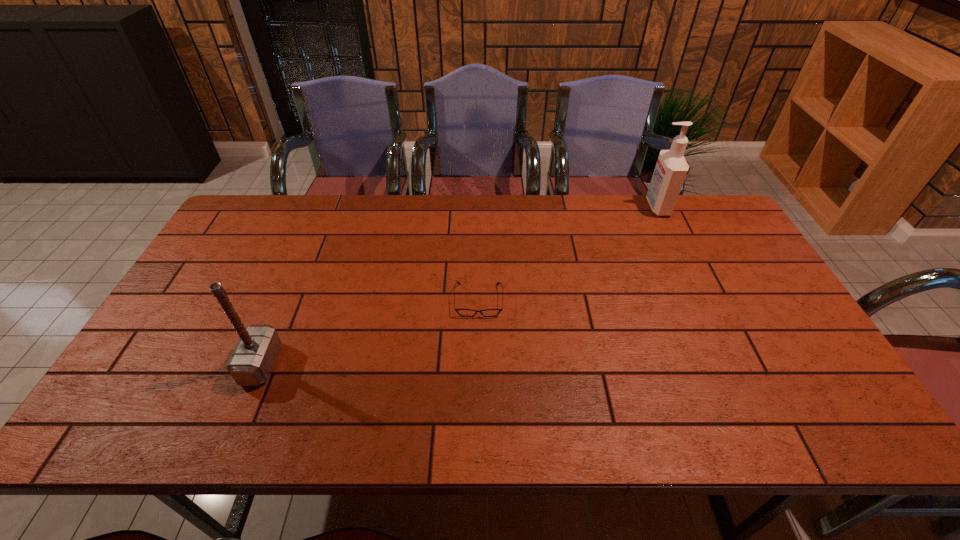
Find the location of a particular element. The image size is (960, 540). free space that satisfies the following two spatial constraints: 1. on the front label of the rightmost object; 2. on the front-facing side of the second farthest object is located at coordinates (702, 300).

At what (x,y) coordinates should I click in order to perform the action: click on vacant space that satisfies the following two spatial constraints: 1. on the front label of the cleansing agent; 2. on the front-facing side of the second farthest object. Please return your answer as a coordinate pair (x, y). This screenshot has height=540, width=960. Looking at the image, I should click on (702, 300).

In order to click on blank area in the image that satisfies the following two spatial constraints: 1. on the front label of the cleansing agent; 2. on the front-facing side of the spectacles in this screenshot , I will do `click(702, 300)`.

Locate an element on the screen. free point that satisfies the following two spatial constraints: 1. on the front label of the rightmost object; 2. on the front-facing side of the second nearest object is located at coordinates (702, 300).

At what (x,y) coordinates should I click in order to perform the action: click on free spot that satisfies the following two spatial constraints: 1. on the front label of the rightmost object; 2. on the front-facing side of the spectacles. Please return your answer as a coordinate pair (x, y). This screenshot has width=960, height=540. Looking at the image, I should click on (702, 300).

Image resolution: width=960 pixels, height=540 pixels. I want to click on vacant region that satisfies the following two spatial constraints: 1. on the front-facing side of the shortest object; 2. on the striking surface of the hammer, so click(x=478, y=364).

Where is `free space in the image that satisfies the following two spatial constraints: 1. on the front label of the farthest object; 2. on the front-facing side of the shortest object`? The image size is (960, 540). free space in the image that satisfies the following two spatial constraints: 1. on the front label of the farthest object; 2. on the front-facing side of the shortest object is located at coordinates (702, 300).